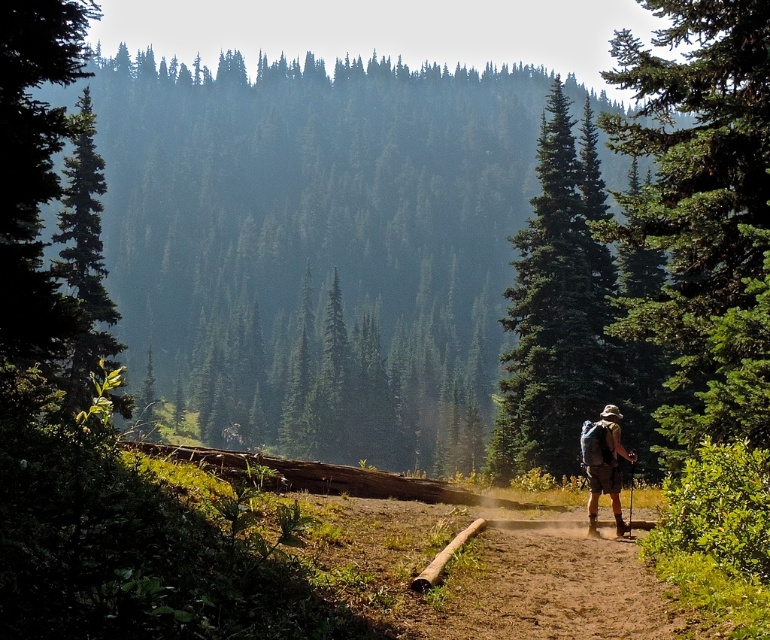
Question: Can you confirm if green matte tree at center is smaller than green matte tree at upper left?

Choices:
 (A) yes
 (B) no

Answer: (A)

Question: Estimate the real-world distances between objects in this image. Which object is closer to the green matte tree at right?

Choices:
 (A) green matte tree at center
 (B) green matte tree at upper left

Answer: (A)

Question: Observing the image, what is the correct spatial positioning of green matte tree at right in reference to green matte tree at upper left?

Choices:
 (A) left
 (B) right

Answer: (B)

Question: Among these points, which one is nearest to the camera?

Choices:
 (A) (742, 332)
 (B) (69, 116)
 (C) (603, 444)

Answer: (A)

Question: Is green matte tree at right to the right of green matte tree at upper left from the viewer's perspective?

Choices:
 (A) yes
 (B) no

Answer: (A)

Question: Which point is farther to the camera?

Choices:
 (A) green matte tree at right
 (B) camouflage fabric backpack at center
 (C) green matte tree at center

Answer: (C)